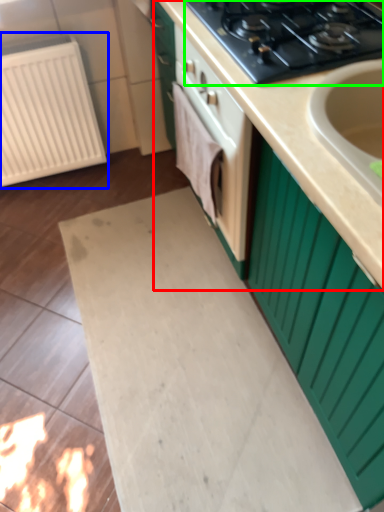
Question: Which is farther away from countertop (highlighted by a red box)? radiator (highlighted by a blue box) or gas stove (highlighted by a green box)?

Choices:
 (A) radiator
 (B) gas stove

Answer: (A)